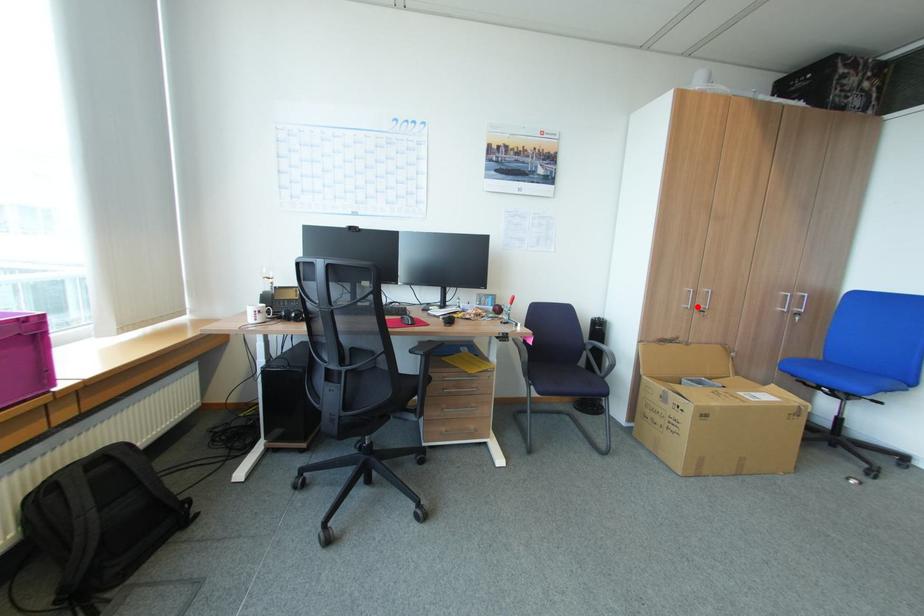
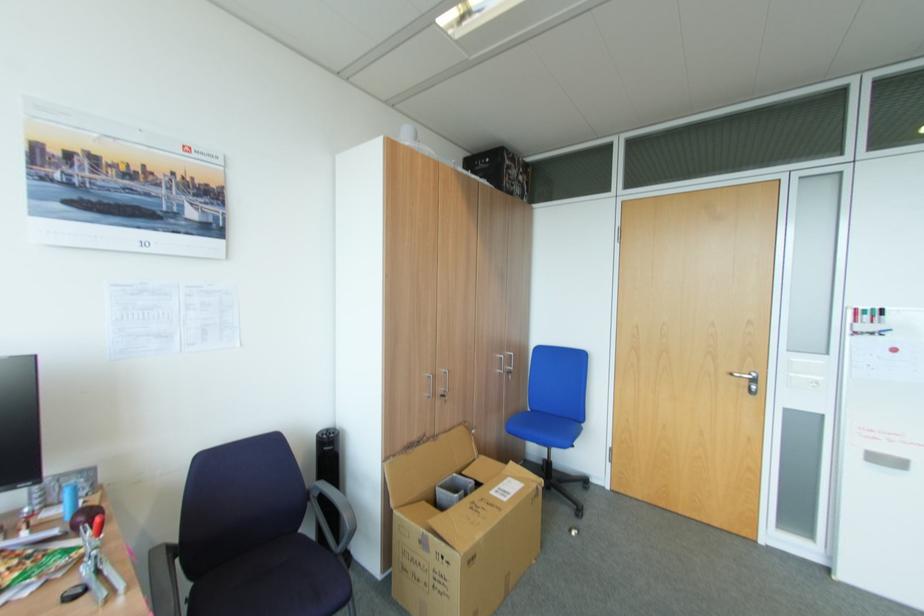
Question: I am providing you with two images of the same scene from different viewpoints. A red point is shown in image1. For the corresponding object point in image2, is it positioned nearer or farther from the camera?

Choices:
 (A) Nearer
 (B) Farther

Answer: (B)